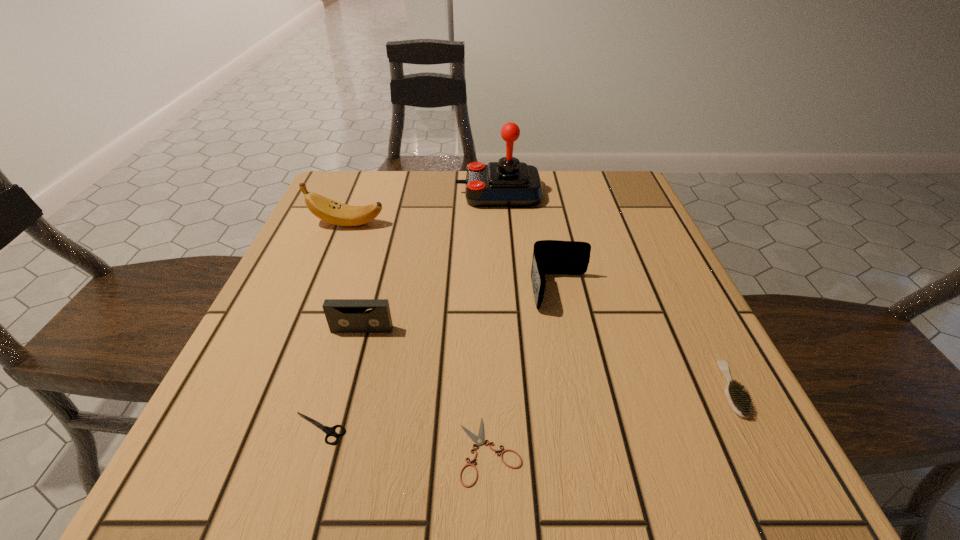
Locate an element on the screen. This screenshot has width=960, height=540. the tallest object is located at coordinates (507, 183).

Locate an element on the screen. This screenshot has height=540, width=960. the farthest object is located at coordinates (507, 183).

Where is `the second farthest object`? The height and width of the screenshot is (540, 960). the second farthest object is located at coordinates coord(328,210).

At what (x,y) coordinates should I click in order to perform the action: click on banana. Please return your answer as a coordinate pair (x, y). Looking at the image, I should click on (328, 210).

You are a GUI agent. You are given a task and a screenshot of the screen. Output one action in this format:
    pyautogui.click(x=<x>, y=<y>)
    Task: Click on the wallet
    Image resolution: width=960 pixels, height=540 pixels.
    Given the screenshot: What is the action you would take?
    pyautogui.click(x=549, y=256)

Where is `the fifth nearest object`? Image resolution: width=960 pixels, height=540 pixels. the fifth nearest object is located at coordinates (549, 256).

Identify the location of the fourth tallest object. This screenshot has height=540, width=960. (343, 315).

Locate an element on the screen. The height and width of the screenshot is (540, 960). the fourth farthest object is located at coordinates (343, 315).

I want to click on the rightmost object, so click(738, 398).

Identify the location of the third shortest object. (738, 398).